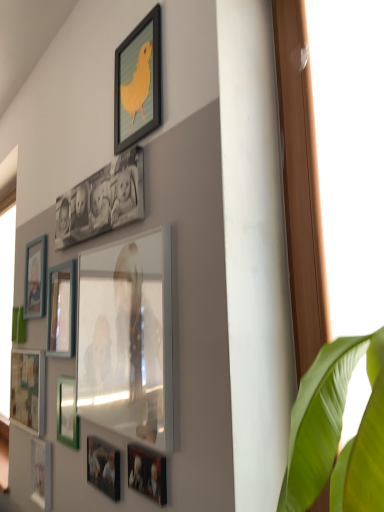
This screenshot has height=512, width=384. What do you see at coordinates (18, 325) in the screenshot? I see `green matte picture frame at lower left, the sixth picture frame from the top` at bounding box center [18, 325].

Describe the element at coordinates (102, 200) in the screenshot. This screenshot has height=512, width=384. I see `matte black photo frame at upper center, the second picture frame viewed from the top` at that location.

What do you see at coordinates (35, 278) in the screenshot? This screenshot has width=384, height=512. I see `matte wooden picture frame at left, which appears as the third picture frame when viewed from the top` at bounding box center [35, 278].

How much space does green matte picture frame at lower left, which is the eighth picture frame in top-to-bottom order, occupy horizontally?

It is 0.70 inches.

What is the approximate width of matte black picture frame at upper center, the first picture frame viewed from the top?

matte black picture frame at upper center, the first picture frame viewed from the top, is 0.98 inches in width.

At what (x,y) coordinates should I click in order to perform the action: click on matte black picture frame at upper center, the first picture frame viewed from the top. Please return your answer as a coordinate pair (x, y). This screenshot has height=512, width=384. Looking at the image, I should click on (138, 83).

The height and width of the screenshot is (512, 384). Find the location of `metallic silver photo frame at lower center, which ranks as the fifth picture frame in bottom-to-top order`. metallic silver photo frame at lower center, which ranks as the fifth picture frame in bottom-to-top order is located at coordinates (147, 473).

Find the location of a particular element. green matte picture frame at lower left, positioned as the sixth picture frame in bottom-to-top order is located at coordinates (18, 325).

From the image's perspective, which is above, green matte picture frame at lower left, which is the eighth picture frame in top-to-bottom order, or wooden photo frame at left, positioned as the fourth picture frame in top-to-bottom order?

From the image's view, wooden photo frame at left, positioned as the fourth picture frame in top-to-bottom order, is above.

How different are the orientations of green matte picture frame at lower left, which is the eighth picture frame in top-to-bottom order, and wooden photo frame at left, the eighth picture frame positioned from the bottom, in degrees?

There is a 0.776-degree angle between the facing directions of green matte picture frame at lower left, which is the eighth picture frame in top-to-bottom order, and wooden photo frame at left, the eighth picture frame positioned from the bottom.

From the picture: Which point is more forward, (x=71, y=401) or (x=48, y=298)?

The point (x=71, y=401) is closer to the camera.

Considering the relative positions of green matte picture frame at lower left, positioned as the fourth picture frame in bottom-to-top order, and wooden photo frame at left, positioned as the fourth picture frame in top-to-bottom order, in the image provided, is green matte picture frame at lower left, positioned as the fourth picture frame in bottom-to-top order, to the left or to the right of wooden photo frame at left, positioned as the fourth picture frame in top-to-bottom order,?

From the image, it's evident that green matte picture frame at lower left, positioned as the fourth picture frame in bottom-to-top order, is to the right of wooden photo frame at left, positioned as the fourth picture frame in top-to-bottom order.

Considering the sizes of objects wooden photo frame at left, the eighth picture frame positioned from the bottom, and matte wooden picture frame at left, which appears as the third picture frame when viewed from the top, in the image provided, who is bigger, wooden photo frame at left, the eighth picture frame positioned from the bottom, or matte wooden picture frame at left, which appears as the third picture frame when viewed from the top,?

wooden photo frame at left, the eighth picture frame positioned from the bottom.

Are wooden photo frame at left, the eighth picture frame positioned from the bottom, and matte wooden picture frame at left, which appears as the third picture frame when viewed from the top, making contact?

No, wooden photo frame at left, the eighth picture frame positioned from the bottom, is not in contact with matte wooden picture frame at left, which appears as the third picture frame when viewed from the top.

Which is more to the right, wooden photo frame at left, positioned as the fourth picture frame in top-to-bottom order, or matte wooden picture frame at left, which appears as the third picture frame when viewed from the top?

wooden photo frame at left, positioned as the fourth picture frame in top-to-bottom order.

Is wooden photo frame at left, positioned as the fourth picture frame in top-to-bottom order, not inside matte wooden picture frame at left, which appears as the third picture frame when viewed from the top?

Yes, wooden photo frame at left, positioned as the fourth picture frame in top-to-bottom order, is located beyond the bounds of matte wooden picture frame at left, which appears as the third picture frame when viewed from the top.

Is matte black picture frame at upper center, the first picture frame viewed from the top, to the left of matte glass picture frame at center, which is counted as the seventh picture frame, starting from the bottom, from the viewer's perspective?

No.

Is point (144, 121) farther from viewer compared to point (85, 267)?

That is False.

From the image's perspective, does matte black picture frame at upper center, the first picture frame viewed from the top, appear lower than matte glass picture frame at center, positioned as the 5th picture frame in top-to-bottom order?

No.

Based on the photo, which of these two, matte black picture frame at upper center, the first picture frame viewed from the top, or matte glass picture frame at center, which is counted as the seventh picture frame, starting from the bottom, is bigger?

Bigger between the two is matte glass picture frame at center, which is counted as the seventh picture frame, starting from the bottom.

Which object is positioned more to the right, matte black picture frame at lower center, which is the 2th picture frame from bottom to top, or wooden photo frame at left, the eighth picture frame positioned from the bottom?

From the viewer's perspective, matte black picture frame at lower center, which is the 2th picture frame from bottom to top, appears more on the right side.

Is point (119, 452) closer to viewer compared to point (67, 330)?

Yes, it is in front of point (67, 330).

Who is bigger, matte black picture frame at lower center, the tenth picture frame in the top-to-bottom sequence, or wooden photo frame at left, positioned as the fourth picture frame in top-to-bottom order?

wooden photo frame at left, positioned as the fourth picture frame in top-to-bottom order.

What's the angular difference between matte white picture frame at lower left, acting as the 9th picture frame starting from the top, and matte black picture frame at upper center, the first picture frame viewed from the top,'s facing directions?

The angle between the facing direction of matte white picture frame at lower left, acting as the 9th picture frame starting from the top, and the facing direction of matte black picture frame at upper center, the first picture frame viewed from the top, is 0.136 degrees.

Is matte white picture frame at lower left, placed as the 3th picture frame when sorted from bottom to top, not near matte black picture frame at upper center, the first picture frame viewed from the top?

matte white picture frame at lower left, placed as the 3th picture frame when sorted from bottom to top, is positioned a significant distance from matte black picture frame at upper center, the first picture frame viewed from the top.

Can you confirm if matte white picture frame at lower left, acting as the 9th picture frame starting from the top, is bigger than matte black picture frame at upper center, the first picture frame viewed from the top?

Indeed, matte white picture frame at lower left, acting as the 9th picture frame starting from the top, has a larger size compared to matte black picture frame at upper center, the first picture frame viewed from the top.

In terms of height, does matte white picture frame at lower left, placed as the 3th picture frame when sorted from bottom to top, look taller or shorter compared to matte black picture frame at upper center, which is the eleventh picture frame from bottom to top?

Considering their sizes, matte white picture frame at lower left, placed as the 3th picture frame when sorted from bottom to top, has less height than matte black picture frame at upper center, which is the eleventh picture frame from bottom to top.

Between metallic silver photo frame at lower center, positioned as the seventh picture frame in top-to-bottom order, and green matte picture frame at lower left, positioned as the fourth picture frame in bottom-to-top order, which one has less height?

metallic silver photo frame at lower center, positioned as the seventh picture frame in top-to-bottom order, is shorter.

The height and width of the screenshot is (512, 384). I want to click on the 1st picture frame above the green matte picture frame at lower left, positioned as the fourth picture frame in bottom-to-top order (from the image's perspective), so click(x=147, y=473).

Considering the sizes of objects metallic silver photo frame at lower center, which ranks as the fifth picture frame in bottom-to-top order, and green matte picture frame at lower left, which is the eighth picture frame in top-to-bottom order, in the image provided, who is bigger, metallic silver photo frame at lower center, which ranks as the fifth picture frame in bottom-to-top order, or green matte picture frame at lower left, which is the eighth picture frame in top-to-bottom order,?

green matte picture frame at lower left, which is the eighth picture frame in top-to-bottom order.

In the image, is metallic silver photo frame at lower center, which ranks as the fifth picture frame in bottom-to-top order, on the left side or the right side of green matte picture frame at lower left, which is the eighth picture frame in top-to-bottom order?

metallic silver photo frame at lower center, which ranks as the fifth picture frame in bottom-to-top order, is to the right of green matte picture frame at lower left, which is the eighth picture frame in top-to-bottom order.

Is matte wooden picture frame at left, which appears as the third picture frame when viewed from the top, oriented away from matte black picture frame at upper center, the first picture frame viewed from the top?

That's not correct — matte wooden picture frame at left, which appears as the third picture frame when viewed from the top, is not looking away from matte black picture frame at upper center, the first picture frame viewed from the top.

Considering the relative positions of matte wooden picture frame at left, which appears as the third picture frame when viewed from the top, and matte black picture frame at upper center, the first picture frame viewed from the top, in the image provided, is matte wooden picture frame at left, which appears as the third picture frame when viewed from the top, to the left of matte black picture frame at upper center, the first picture frame viewed from the top, from the viewer's perspective?

Yes.

Based on the photo, how much distance is there between matte wooden picture frame at left, which is the ninth picture frame from bottom to top, and matte black picture frame at upper center, which is the eleventh picture frame from bottom to top?

A distance of 33.00 inches exists between matte wooden picture frame at left, which is the ninth picture frame from bottom to top, and matte black picture frame at upper center, which is the eleventh picture frame from bottom to top.

From a real-world perspective, is matte wooden picture frame at left, which is the ninth picture frame from bottom to top, positioned under matte black picture frame at upper center, which is the eleventh picture frame from bottom to top, based on gravity?

Indeed, from a real-world perspective, matte wooden picture frame at left, which is the ninth picture frame from bottom to top, is positioned beneath matte black picture frame at upper center, which is the eleventh picture frame from bottom to top.

Find the location of `the 1st picture frame behind the green matte picture frame at lower left, which is the eighth picture frame in top-to-bottom order, starting your count from the anchor`. the 1st picture frame behind the green matte picture frame at lower left, which is the eighth picture frame in top-to-bottom order, starting your count from the anchor is located at coordinates (61, 310).

This screenshot has height=512, width=384. I want to click on the 1st picture frame below the matte wooden picture frame at left, which is the ninth picture frame from bottom to top (from the image's perspective), so click(61, 310).

Estimate the real-world distances between objects in this image. Which object is closer to matte black picture frame at lower center, the tenth picture frame in the top-to-bottom sequence, matte black picture frame at upper center, the first picture frame viewed from the top, or matte wooden picture frame at left, which appears as the third picture frame when viewed from the top?

matte wooden picture frame at left, which appears as the third picture frame when viewed from the top, is closer to matte black picture frame at lower center, the tenth picture frame in the top-to-bottom sequence.

When comparing their distances from matte black picture frame at lower center, which is the 2th picture frame from bottom to top, does green matte picture frame at lower left, which is the eighth picture frame in top-to-bottom order, or green matte picture frame at lower left, positioned as the sixth picture frame in bottom-to-top order, seem further?

green matte picture frame at lower left, positioned as the sixth picture frame in bottom-to-top order, is positioned further to the anchor matte black picture frame at lower center, which is the 2th picture frame from bottom to top.

Consider the image. Looking at the image, which one is located closer to green matte picture frame at lower left, the sixth picture frame from the top, metallic silver photo frame at lower center, which ranks as the fifth picture frame in bottom-to-top order, or matte black picture frame at lower center, which is the 2th picture frame from bottom to top?

matte black picture frame at lower center, which is the 2th picture frame from bottom to top, lies closer to green matte picture frame at lower left, the sixth picture frame from the top, than the other object.

Which object lies further to the anchor point green matte picture frame at lower left, the sixth picture frame from the top, matte white picture frame at lower left, the 11th picture frame from the top, or wooden photo frame at left, positioned as the fourth picture frame in top-to-bottom order?

matte white picture frame at lower left, the 11th picture frame from the top, lies further to green matte picture frame at lower left, the sixth picture frame from the top, than the other object.

When comparing their distances from matte black picture frame at upper center, the first picture frame viewed from the top, does metallic silver photo frame at lower center, positioned as the seventh picture frame in top-to-bottom order, or matte glass picture frame at center, positioned as the 5th picture frame in top-to-bottom order, seem further?

Based on the image, metallic silver photo frame at lower center, positioned as the seventh picture frame in top-to-bottom order, appears to be further to matte black picture frame at upper center, the first picture frame viewed from the top.

From the image, which object appears to be farther from matte black picture frame at lower center, the tenth picture frame in the top-to-bottom sequence, green matte picture frame at lower left, the sixth picture frame from the top, or matte black picture frame at upper center, the first picture frame viewed from the top?

matte black picture frame at upper center, the first picture frame viewed from the top.

When comparing their distances from green matte picture frame at lower left, positioned as the fourth picture frame in bottom-to-top order, does matte white picture frame at lower left, placed as the 3th picture frame when sorted from bottom to top, or metallic silver photo frame at lower center, positioned as the seventh picture frame in top-to-bottom order, seem closer?

The object closer to green matte picture frame at lower left, positioned as the fourth picture frame in bottom-to-top order, is matte white picture frame at lower left, placed as the 3th picture frame when sorted from bottom to top.

Based on their spatial positions, is matte wooden picture frame at left, which appears as the third picture frame when viewed from the top, or matte black picture frame at lower center, the tenth picture frame in the top-to-bottom sequence, further from matte glass picture frame at center, which is counted as the seventh picture frame, starting from the bottom?

matte wooden picture frame at left, which appears as the third picture frame when viewed from the top, is further to matte glass picture frame at center, which is counted as the seventh picture frame, starting from the bottom.